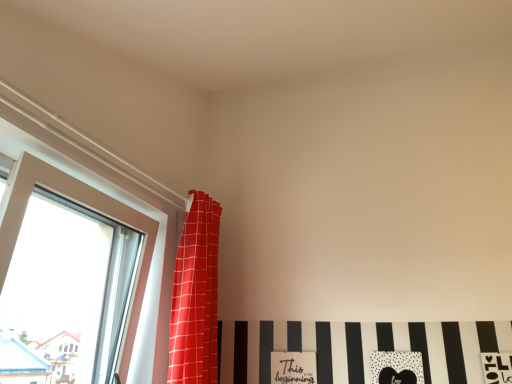
Question: Considering the positions of point (29, 153) and point (184, 370), is point (29, 153) closer or farther from the camera than point (184, 370)?

Choices:
 (A) farther
 (B) closer

Answer: (B)

Question: Considering the positions of clear glass window at left and red checkered curtain at upper left in the image, is clear glass window at left bigger or smaller than red checkered curtain at upper left?

Choices:
 (A) small
 (B) big

Answer: (B)

Question: Is clear glass window at left wider or thinner than red checkered curtain at upper left?

Choices:
 (A) thin
 (B) wide

Answer: (A)

Question: From a real-world perspective, is red checkered curtain at upper left above or below clear glass window at left?

Choices:
 (A) above
 (B) below

Answer: (A)

Question: Is red checkered curtain at upper left bigger or smaller than clear glass window at left?

Choices:
 (A) big
 (B) small

Answer: (B)

Question: From their relative heights in the image, would you say red checkered curtain at upper left is taller or shorter than clear glass window at left?

Choices:
 (A) tall
 (B) short

Answer: (A)

Question: Looking at their shapes, would you say red checkered curtain at upper left is wider or thinner than clear glass window at left?

Choices:
 (A) thin
 (B) wide

Answer: (B)